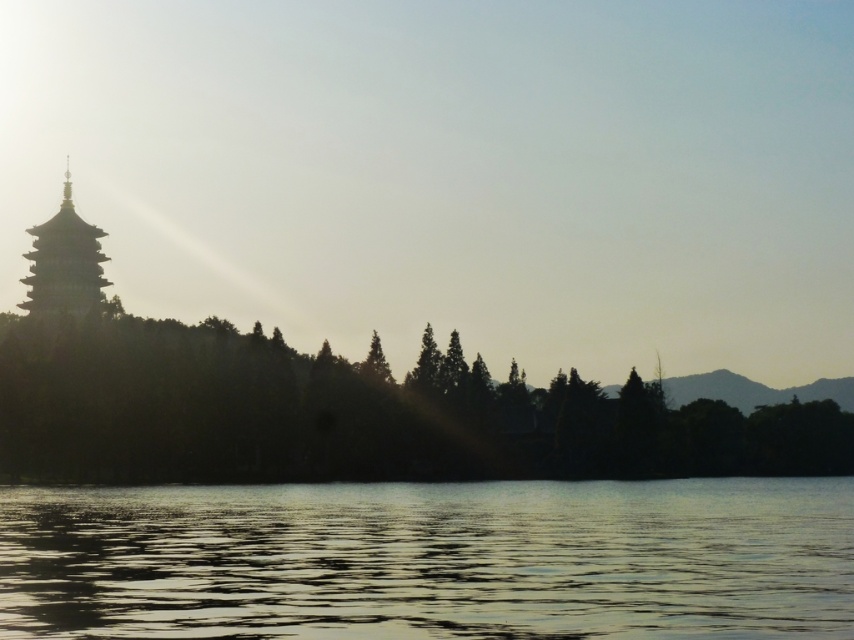
Question: Does silvery reflective water at lower center appear under silhouette tree at left?

Choices:
 (A) no
 (B) yes

Answer: (B)

Question: Does silhouette tree at left appear over matte gray pagoda at left?

Choices:
 (A) no
 (B) yes

Answer: (A)

Question: Considering the real-world distances, which object is farthest from the silvery reflective water at lower center?

Choices:
 (A) matte gray pagoda at left
 (B) silhouette tree at left

Answer: (A)

Question: Does silvery reflective water at lower center appear on the left side of silhouette tree at left?

Choices:
 (A) yes
 (B) no

Answer: (B)

Question: Which object is the farthest from the silhouette tree at left?

Choices:
 (A) silvery reflective water at lower center
 (B) matte gray pagoda at left

Answer: (B)

Question: Estimate the real-world distances between objects in this image. Which object is closer to the matte gray pagoda at left?

Choices:
 (A) silhouette tree at left
 (B) silvery reflective water at lower center

Answer: (A)